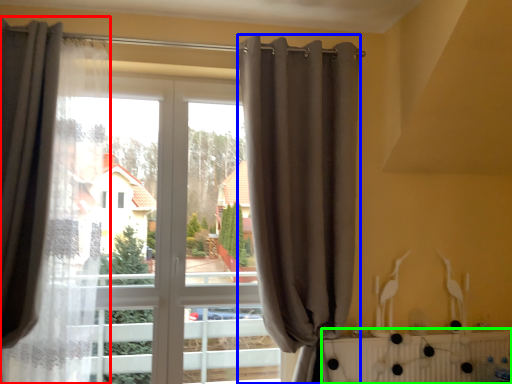
Question: Based on their relative distances, which object is farther from curtain (highlighted by a red box)? Choose from curtain (highlighted by a blue box) and radiator (highlighted by a green box).

Choices:
 (A) curtain
 (B) radiator

Answer: (B)